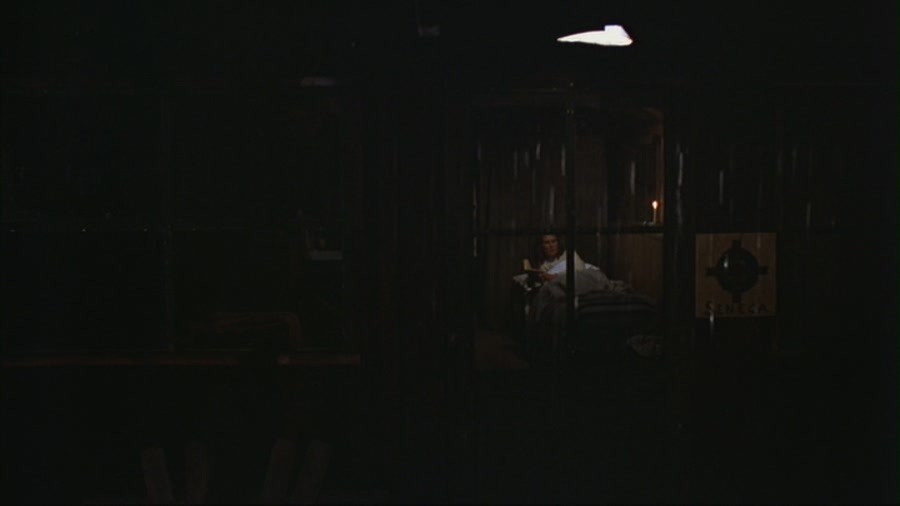
What are the coordinates of `window` in the screenshot? It's located at (572, 233).